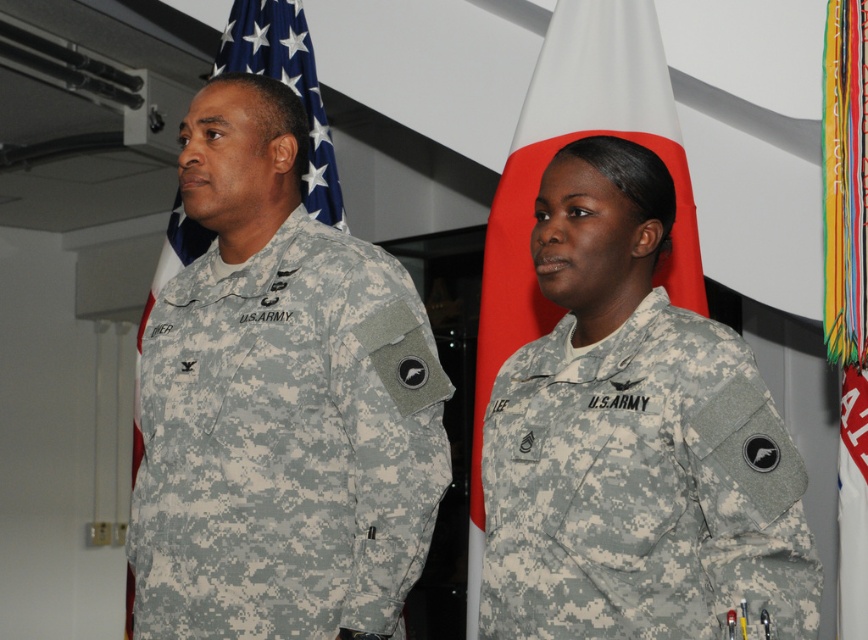
Locate an element on the screen. The width and height of the screenshot is (868, 640). camouflage fabric uniform at left is located at coordinates (279, 403).

Consider the image. Is camouflage fabric uniform at left positioned behind camouflage fabric uniform at center?

Yes, camouflage fabric uniform at left is behind camouflage fabric uniform at center.

Where is `camouflage fabric uniform at left`? camouflage fabric uniform at left is located at coordinates (279, 403).